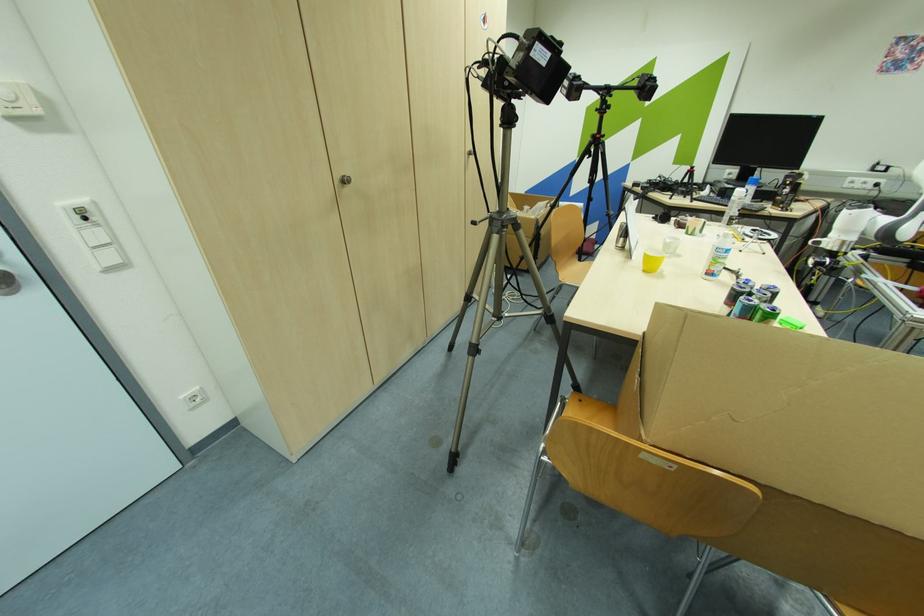
Where would you pull the silver door handle? Please return your answer as a coordinate pair (x, y).

(345, 180)